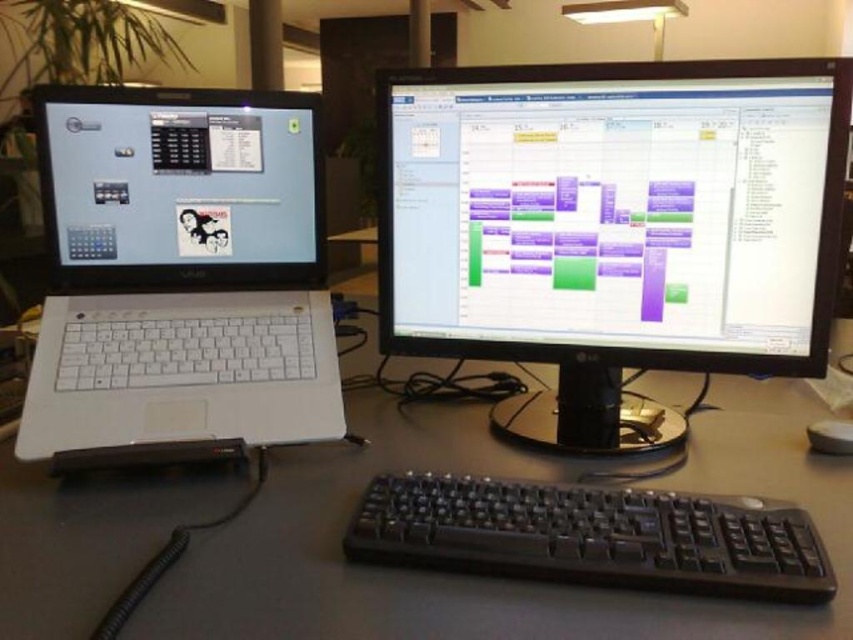
You are setting up a new monitor stand that requires the monitor to be taller than the laptop. Based on the scene, can the matte black monitor at center and the matte black laptop at left be placed on the stand as required?

The matte black monitor at center has a greater height compared to the matte black laptop at left, so yes, they can be placed on the stand as required since the monitor is taller than the laptop.

You are organizing your desk and need to place a new mouse between the white plastic laptop at left and the black plastic keyboard at center. Based on their positions, where should you place the mouse?

The white plastic laptop at left is above the black plastic keyboard at center, so placing the mouse between them would require positioning it below the white plastic laptop at left and above the black plastic keyboard at center.

You are looking at the desk setup and need to place a small sticker on either the point at coordinates point (708, 212) or point (283, 150). Which point is closer to you so the sticker will be more visible?

Point (708, 212) is closer to the viewer than point (283, 150), so placing the sticker there will make it more visible.